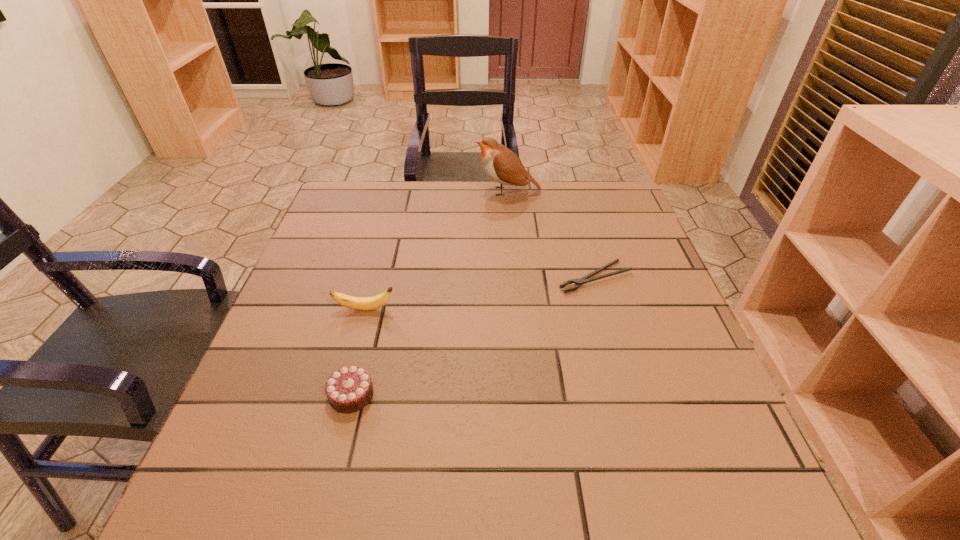
Where is `vacant point located between the tongs and the bird`? vacant point located between the tongs and the bird is located at coordinates (551, 234).

Where is `free space between the banana and the farthest object`? The width and height of the screenshot is (960, 540). free space between the banana and the farthest object is located at coordinates (437, 251).

Where is `object that is the third closest to the second farthest object`? This screenshot has width=960, height=540. object that is the third closest to the second farthest object is located at coordinates (349, 389).

Select which object appears as the third closest to the chocolate cake. Please provide its 2D coordinates. Your answer should be formatted as a tuple, i.e. [(x, y)], where the tuple contains the x and y coordinates of a point satisfying the conditions above.

[(502, 165)]

Identify the location of vacant region that satisfies the following two spatial constraints: 1. at the stem of the banana; 2. on the back side of the third tallest object. This screenshot has height=540, width=960. pos(343,394).

At what (x,y) coordinates should I click in order to perform the action: click on free location that satisfies the following two spatial constraints: 1. on the front side of the second farthest object; 2. at the stem of the second nearest object. Please return your answer as a coordinate pair (x, y). Looking at the image, I should click on (605, 309).

Identify the location of free space that satisfies the following two spatial constraints: 1. at the stem of the second nearest object; 2. on the back side of the chocolate cake. This screenshot has height=540, width=960. (343, 394).

The width and height of the screenshot is (960, 540). In order to click on vacant position in the image that satisfies the following two spatial constraints: 1. at the stem of the second tallest object; 2. on the left side of the chocolate cake in this screenshot , I will do `click(343, 394)`.

Locate an element on the screen. Image resolution: width=960 pixels, height=540 pixels. free location that satisfies the following two spatial constraints: 1. at the face of the bird; 2. on the right side of the second farthest object is located at coordinates (x=516, y=277).

I want to click on free spot that satisfies the following two spatial constraints: 1. at the stem of the nearest object; 2. on the left side of the third farthest object, so click(343, 394).